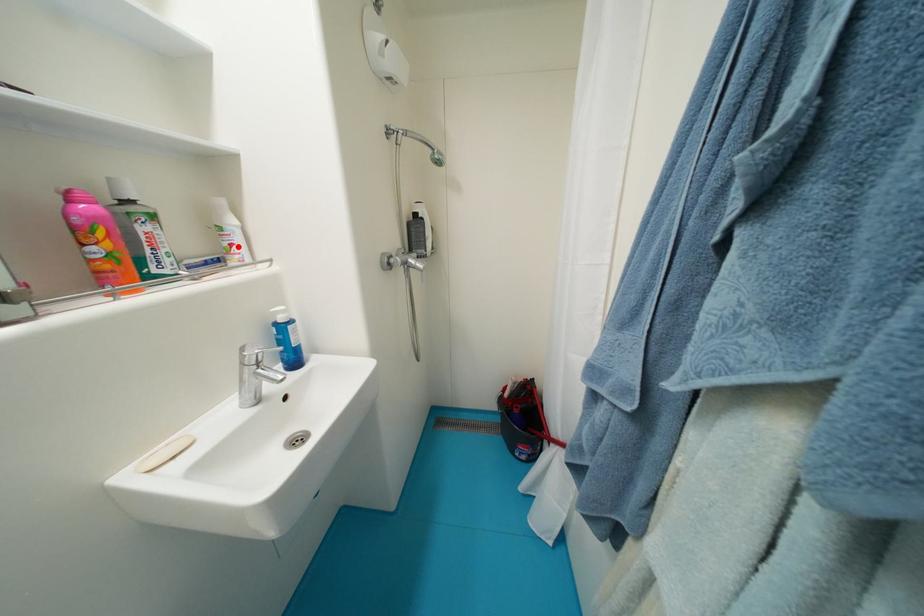
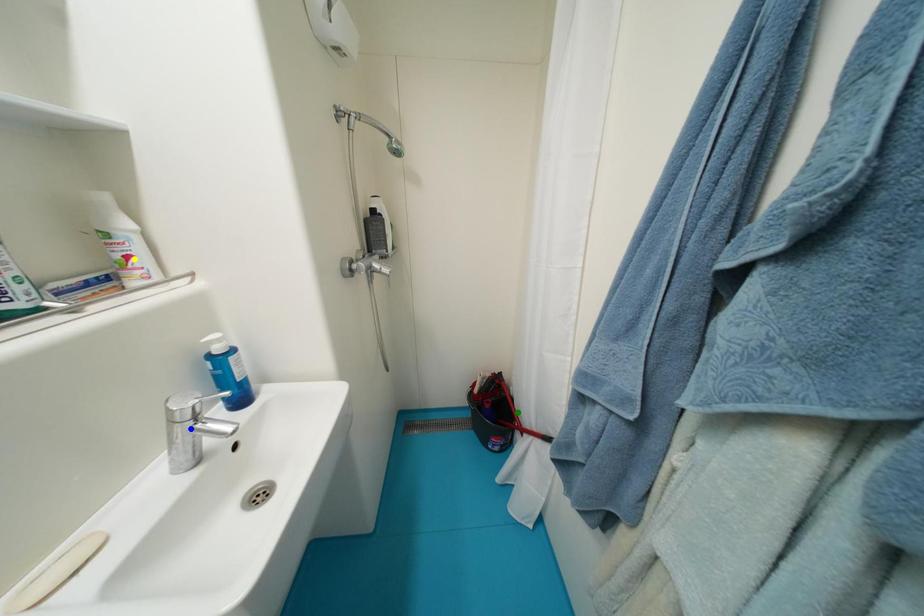
Question: I am providing you with two images of the same scene from different viewpoints. A red point is marked on the first image. You are given multiple points on the second image. Can you choose the point in image 2 that corresponds to the point in image 1?

Choices:
 (A) yellow point
 (B) green point
 (C) blue point

Answer: (A)